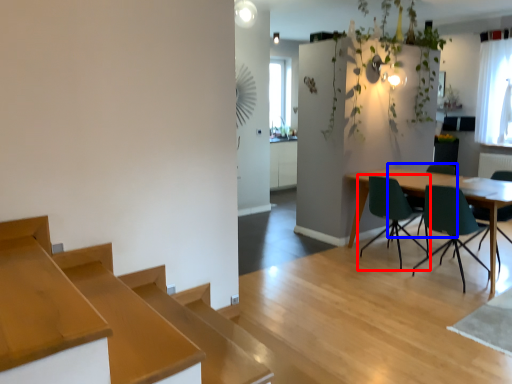
Question: Which object is closer to the camera taking this photo, chair (highlighted by a red box) or chair (highlighted by a blue box)?

Choices:
 (A) chair
 (B) chair

Answer: (A)